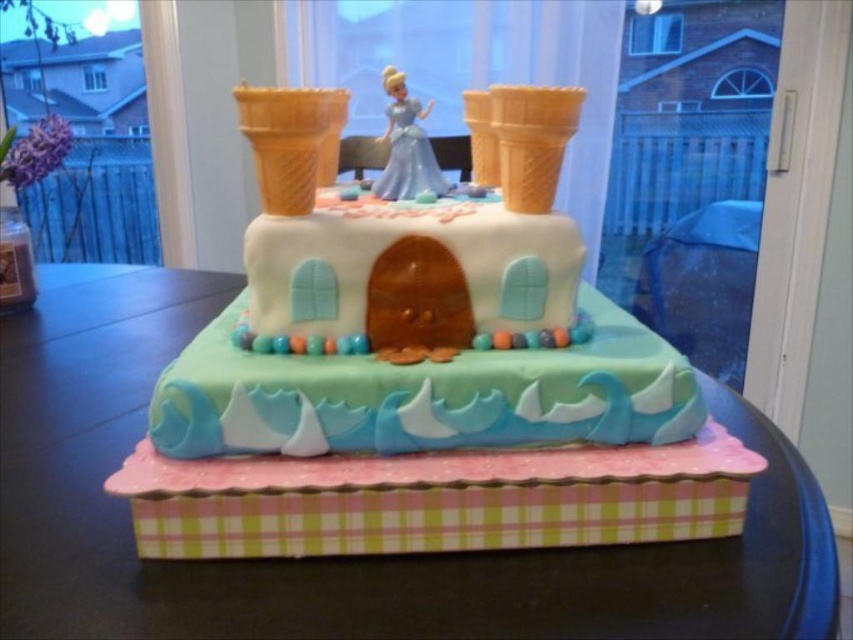
Can you confirm if pink paperboard at center is positioned above golden waffle cone at upper right?

No.

Between pink paperboard at center and golden waffle cone at upper right, which one appears on the right side from the viewer's perspective?

From the viewer's perspective, golden waffle cone at upper right appears more on the right side.

The image size is (853, 640). I want to click on pink paperboard at center, so click(x=338, y=557).

You are a GUI agent. You are given a task and a screenshot of the screen. Output one action in this format:
    pyautogui.click(x=<x>, y=<y>)
    Task: Click on the pink paperboard at center
    The image size is (853, 640).
    Given the screenshot: What is the action you would take?
    pyautogui.click(x=338, y=557)

Is smooth white castle at center taller than golden waffle cone at upper center?

Yes.

Is smooth white castle at center wider than golden waffle cone at upper center?

Correct, the width of smooth white castle at center exceeds that of golden waffle cone at upper center.

Measure the distance between smooth white castle at center and camera.

smooth white castle at center and camera are 13.69 inches apart.

Where is `smooth white castle at center`? This screenshot has height=640, width=853. smooth white castle at center is located at coordinates (426, 324).

Is golden waffle cone at upper center shorter than satin blue dress at center?

Yes.

Between point (277, 176) and point (407, 161), which one is positioned in front?

Point (277, 176) is more forward.

The width and height of the screenshot is (853, 640). Find the location of `golden waffle cone at upper center`. golden waffle cone at upper center is located at coordinates (291, 141).